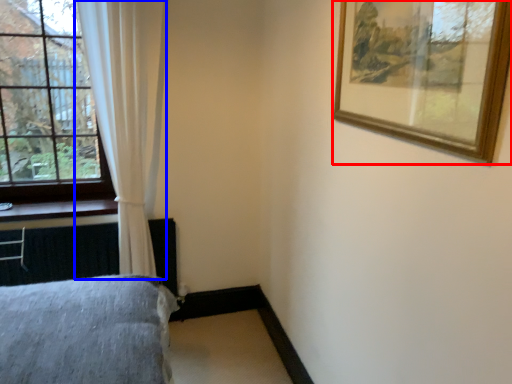
Question: Among these objects, which one is nearest to the camera, picture frame (highlighted by a red box) or curtain (highlighted by a blue box)?

Choices:
 (A) picture frame
 (B) curtain

Answer: (A)